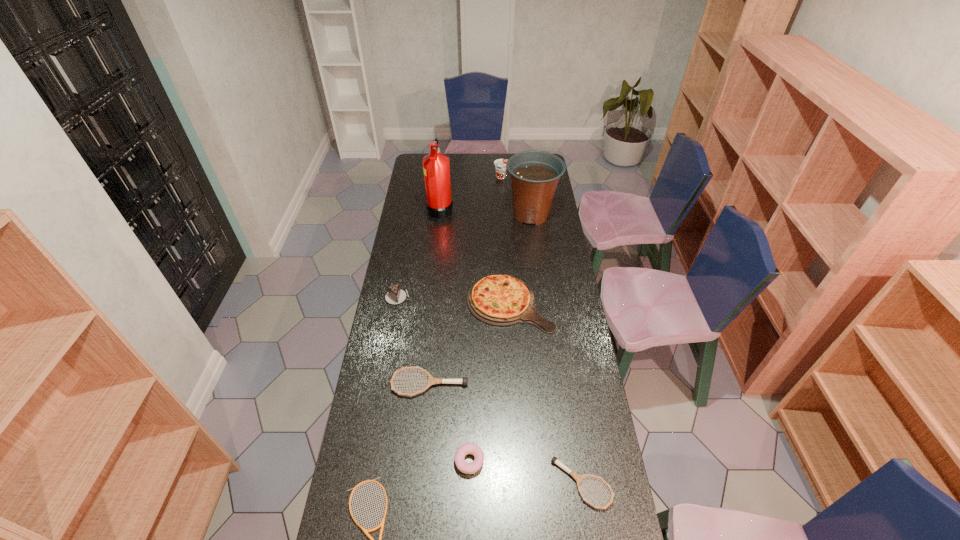
Where is `the tallest object`? the tallest object is located at coordinates (439, 204).

This screenshot has height=540, width=960. I want to click on red fire extinguisher, so click(439, 204).

Where is `flowerpot`? The width and height of the screenshot is (960, 540). flowerpot is located at coordinates (534, 174).

Identify the location of the farthest object. The width and height of the screenshot is (960, 540). (500, 164).

Locate an element on the screen. the seventh shortest object is located at coordinates (500, 164).

I want to click on chocolate cake, so click(395, 295).

Locate an element on the screen. This screenshot has width=960, height=540. pizza is located at coordinates (500, 300).

Find the location of a particular element. the sixth tallest object is located at coordinates (467, 448).

In order to click on doughnut in this screenshot , I will do `click(467, 448)`.

The height and width of the screenshot is (540, 960). I want to click on the fourth nearest object, so click(x=431, y=380).